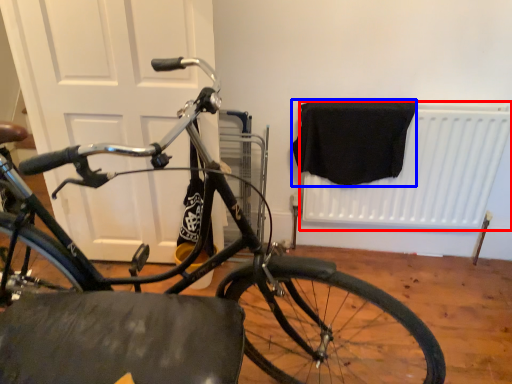
Question: Which of the following is the farthest to the observer, radiator (highlighted by a red box) or blanket (highlighted by a blue box)?

Choices:
 (A) radiator
 (B) blanket

Answer: (A)